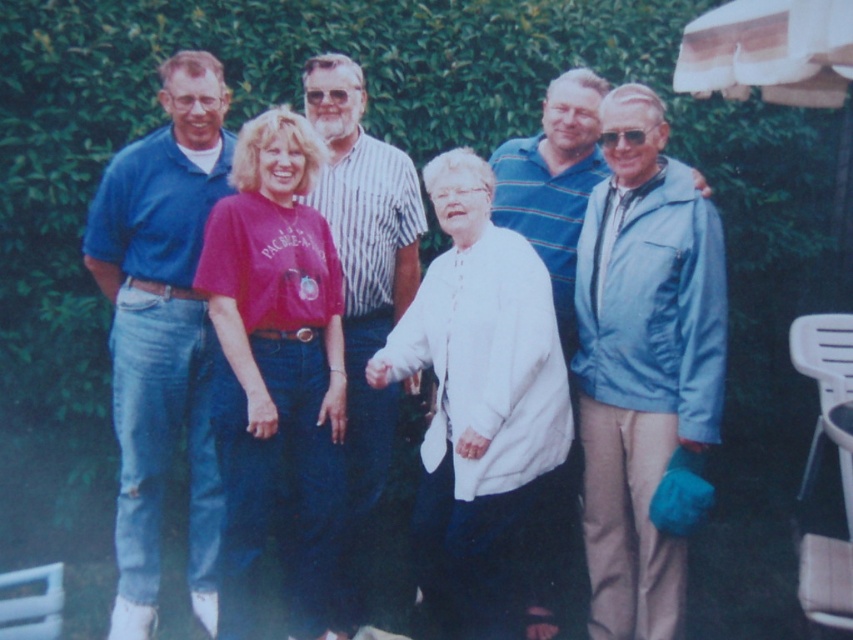
Is point (376, 179) farther from viewer compared to point (453, 378)?

Yes.

Does matte blue shirt at center have a greater width compared to white cotton shirt at center?

In fact, matte blue shirt at center might be narrower than white cotton shirt at center.

Find the location of a particular element. This screenshot has height=640, width=853. matte blue shirt at center is located at coordinates (161, 332).

Is matte red t-shirt at center closer to the viewer compared to striped cotton shirt at center?

That is True.

Is point (248, 145) less distant than point (357, 454)?

Yes, it is in front of point (357, 454).

Locate an element on the screen. The width and height of the screenshot is (853, 640). matte red t-shirt at center is located at coordinates (276, 364).

Does matte red t-shirt at center have a larger size compared to matte blue polo shirt at left?

Correct, matte red t-shirt at center is larger in size than matte blue polo shirt at left.

Between point (251, 243) and point (137, 572), which one is positioned in front?

Point (251, 243) is in front.

Locate an element on the screen. This screenshot has height=640, width=853. matte red t-shirt at center is located at coordinates (276, 364).

At what (x,y) coordinates should I click in order to perform the action: click on matte red t-shirt at center. Please return your answer as a coordinate pair (x, y). This screenshot has width=853, height=640. Looking at the image, I should click on (276, 364).